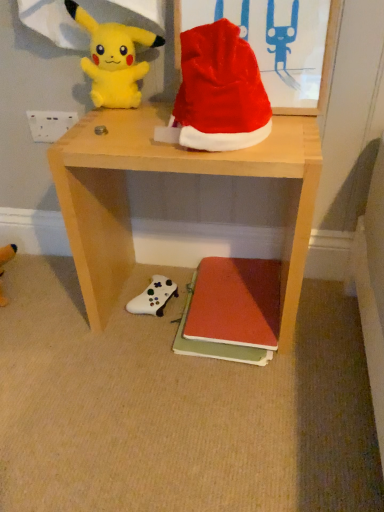
You are a GUI agent. You are given a task and a screenshot of the screen. Output one action in this format:
    pyautogui.click(x=<x>, y=<y>)
    Task: Click on the empty space that is in between white matte game controller at lower center, acting as the first toy starting from the back, and matte red book at lower center
    
    Given the screenshot: What is the action you would take?
    pyautogui.click(x=170, y=313)